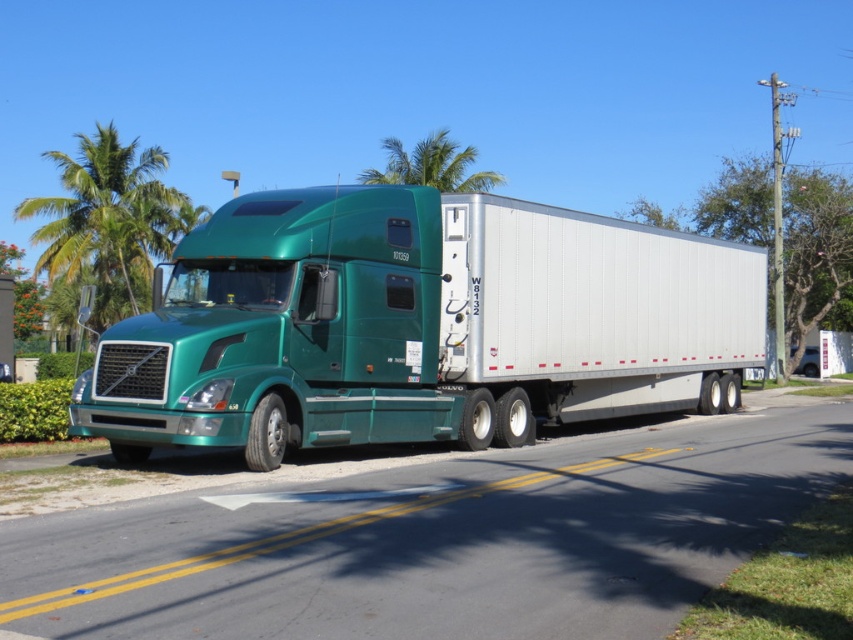
You are a delivery driver who needs to take a photo of the green leafy palm tree at upper left for a navigation app. Where exactly should you position yourself to capture the tree in the photo?

The green leafy palm tree at upper left is located at point (109, 220), so you should position yourself directly in front of that coordinate to capture it in the photo.